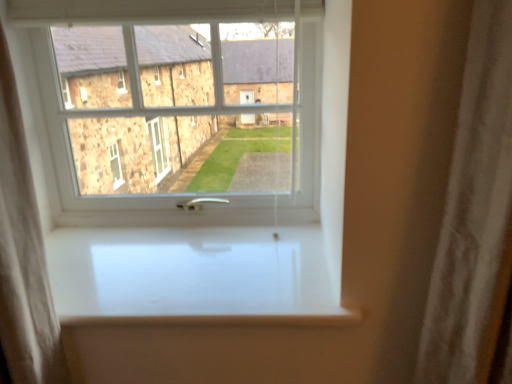
Question: Can you confirm if white glossy window sill at center is positioned to the right of white plastic window at center?

Choices:
 (A) no
 (B) yes

Answer: (B)

Question: Considering the relative sizes of white glossy window sill at center and white plastic window at center in the image provided, is white glossy window sill at center taller than white plastic window at center?

Choices:
 (A) yes
 (B) no

Answer: (B)

Question: Is white glossy window sill at center aimed at white plastic window at center?

Choices:
 (A) no
 (B) yes

Answer: (A)

Question: Is white glossy window sill at center positioned with its back to white plastic window at center?

Choices:
 (A) no
 (B) yes

Answer: (A)

Question: From the image's perspective, is white glossy window sill at center located above white plastic window at center?

Choices:
 (A) yes
 (B) no

Answer: (B)

Question: From a real-world perspective, is white glossy window sill at center beneath white plastic window at center?

Choices:
 (A) no
 (B) yes

Answer: (B)

Question: From a real-world perspective, is white plastic window at center beneath white glossy window sill at center?

Choices:
 (A) no
 (B) yes

Answer: (A)

Question: From the image's perspective, would you say white plastic window at center is positioned over white glossy window sill at center?

Choices:
 (A) yes
 (B) no

Answer: (A)

Question: Considering the relative sizes of white plastic window at center and white glossy window sill at center in the image provided, is white plastic window at center taller than white glossy window sill at center?

Choices:
 (A) no
 (B) yes

Answer: (B)

Question: Is white plastic window at center facing towards white glossy window sill at center?

Choices:
 (A) yes
 (B) no

Answer: (A)

Question: Is white plastic window at center positioned with its back to white glossy window sill at center?

Choices:
 (A) yes
 (B) no

Answer: (B)

Question: Can you confirm if white plastic window at center is wider than white glossy window sill at center?

Choices:
 (A) no
 (B) yes

Answer: (A)

Question: Considering the positions of white glossy window sill at center and white plastic window at center in the image, is white glossy window sill at center taller or shorter than white plastic window at center?

Choices:
 (A) tall
 (B) short

Answer: (B)